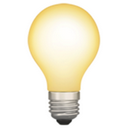
In order to click on cork in this screenshot , I will do [x=67, y=122].